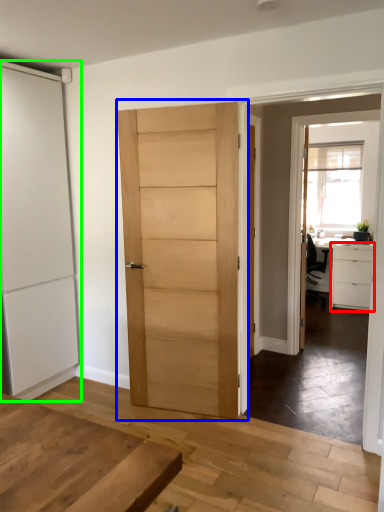
Question: Considering the real-world distances, which object is farthest from cabinetry (highlighted by a red box)? door (highlighted by a blue box) or door (highlighted by a green box)?

Choices:
 (A) door
 (B) door

Answer: (B)